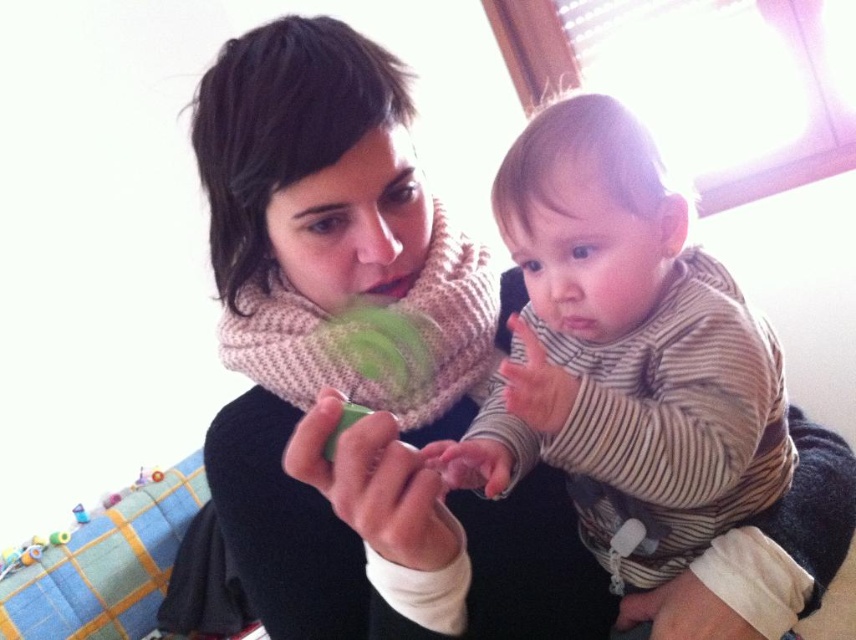
You are a photographer setting up a shot of the adult and baby. You need to ensure the striped cotton shirt at center and green matte toy at center are both visible in the frame. Given their sizes, which object should you focus on to ensure both are in focus?

The striped cotton shirt at center is taller than the green matte toy at center, so focusing on the striped cotton shirt at center will ensure both are in focus since it is the larger object.

In the scene where an adult and a baby are interacting, the adult is holding a green matte toy at center. The baby is reaching towards it. If the adult moves their hand 0.1 units to the left along the x axis from point [375,484], will the baby still be able to see the toy?

The green matte toy at center is represented by point [375,484]. Moving it 0.1 units left along the x axis would still keep it within the baby and adult viewing area, so yes, the baby can still see the toy.